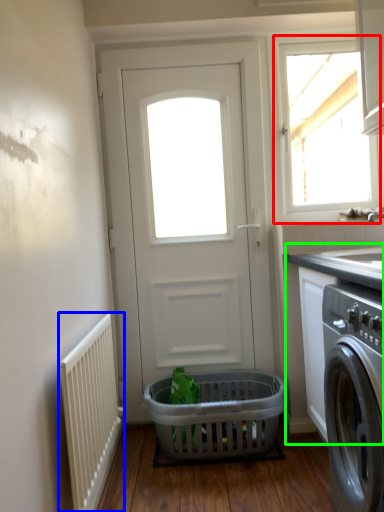
Question: Considering the real-world distances, which object is closest to window (highlighted by a red box)? radiator (highlighted by a blue box) or counter top (highlighted by a green box).

Choices:
 (A) radiator
 (B) counter top

Answer: (B)